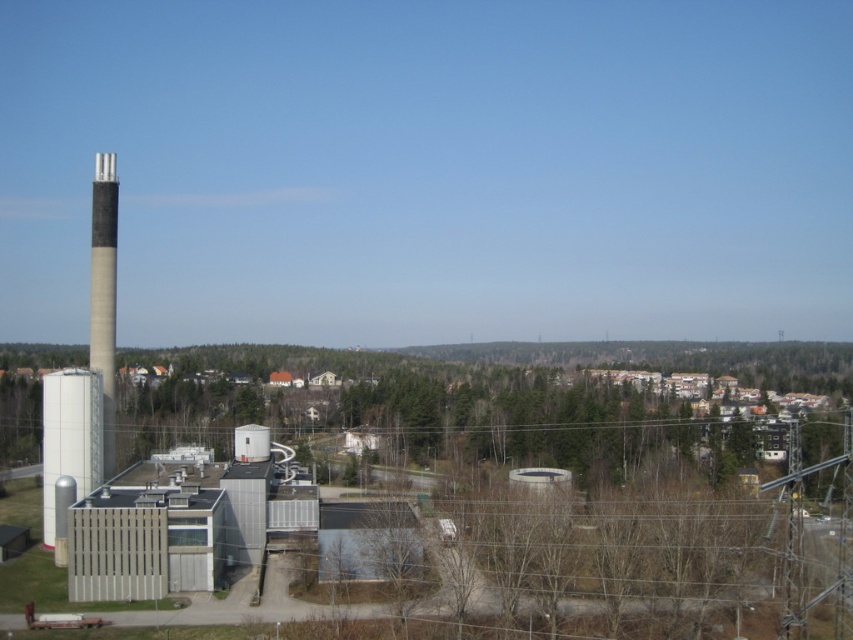
Question: Can you confirm if white matte water tower at lower left is positioned below smooth concrete chimney at left?

Choices:
 (A) no
 (B) yes

Answer: (B)

Question: Which point is farther to the camera?

Choices:
 (A) (173, 513)
 (B) (44, 378)

Answer: (B)

Question: Is white matte water tower at lower left below smooth concrete chimney at left?

Choices:
 (A) no
 (B) yes

Answer: (B)

Question: From the image, what is the correct spatial relationship of white matte water tower at lower left in relation to smooth concrete chimney at left?

Choices:
 (A) below
 (B) above

Answer: (A)

Question: Which of the following is the farthest from the observer?

Choices:
 (A) (74, 467)
 (B) (90, 316)
 (C) (252, 470)

Answer: (B)

Question: Which point is farther to the camera?

Choices:
 (A) (111, 179)
 (B) (227, 506)
 (C) (44, 508)

Answer: (A)